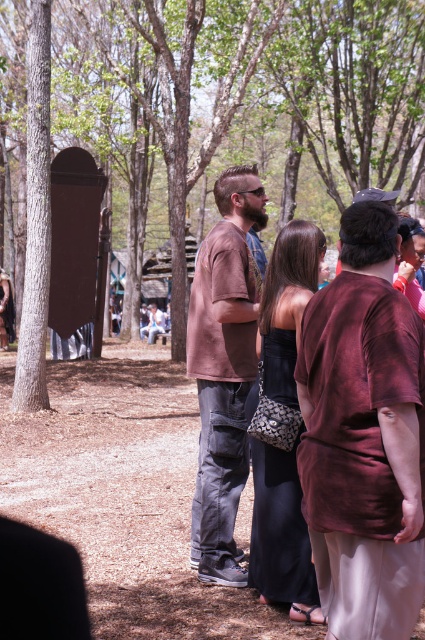
Question: Is brown bark tree at center above brown cotton shirt at center?

Choices:
 (A) no
 (B) yes

Answer: (B)

Question: Is brown bark tree at center above brown cotton shirt at center?

Choices:
 (A) yes
 (B) no

Answer: (A)

Question: Which of the following is the closest to the observer?

Choices:
 (A) brown cotton shirt at center
 (B) brown bark tree at center

Answer: (A)

Question: Does brown bark tree at center have a larger size compared to brown cotton shirt at center?

Choices:
 (A) no
 (B) yes

Answer: (B)

Question: Which point appears farthest from the camera in this image?

Choices:
 (A) (231, 401)
 (B) (336, 92)

Answer: (B)